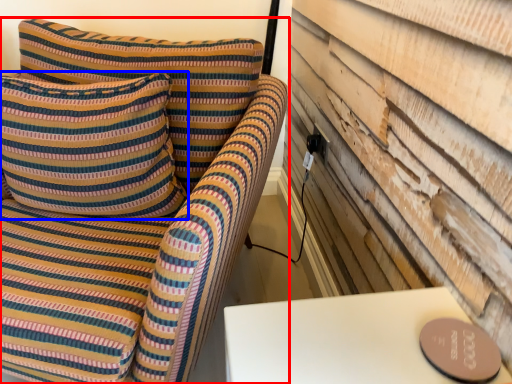
Question: Which object appears farthest to the camera in this image, furniture (highlighted by a red box) or pillow (highlighted by a blue box)?

Choices:
 (A) furniture
 (B) pillow

Answer: (B)